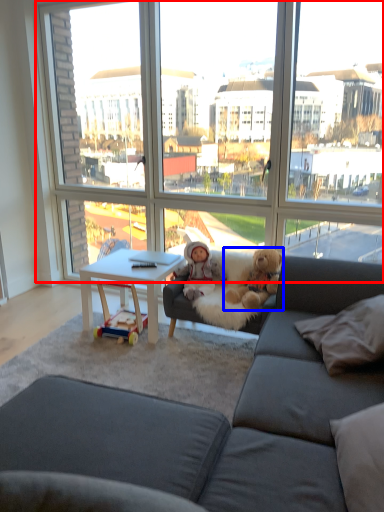
Question: Which of the following is the farthest to the observer, window (highlighted by a red box) or teddy bear (highlighted by a blue box)?

Choices:
 (A) window
 (B) teddy bear

Answer: (B)